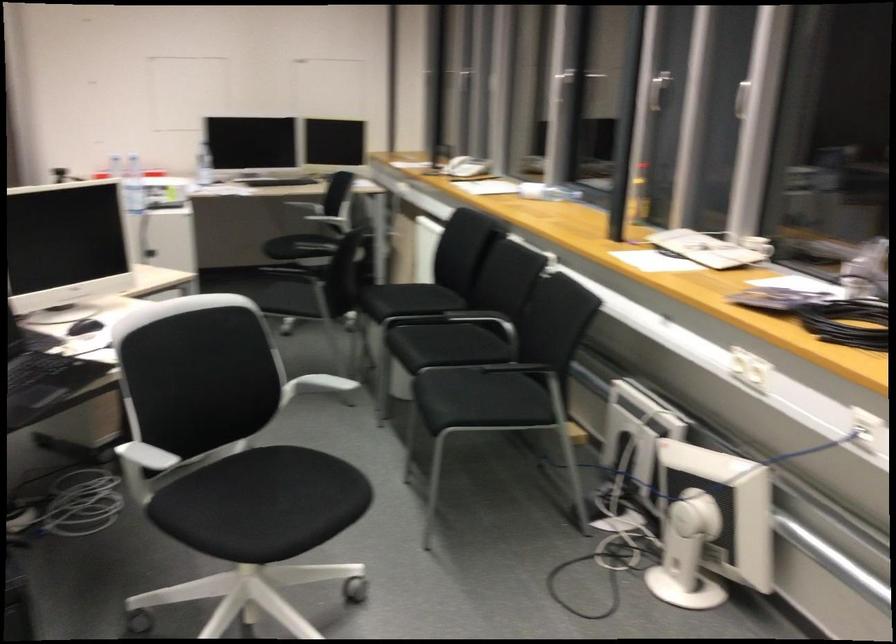
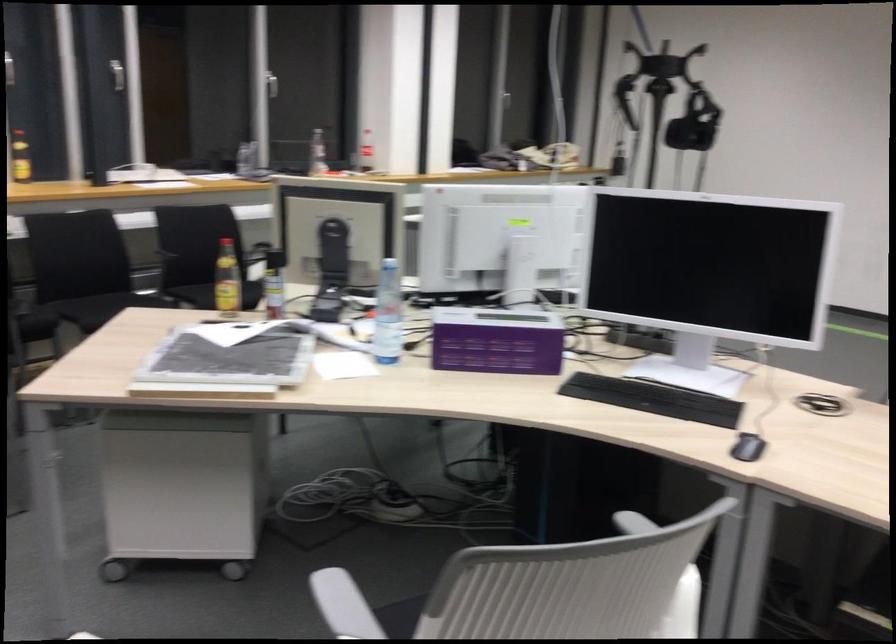
Locate, in the second image, the point that corresponds to pixel 771 76 in the first image.

(118, 79)